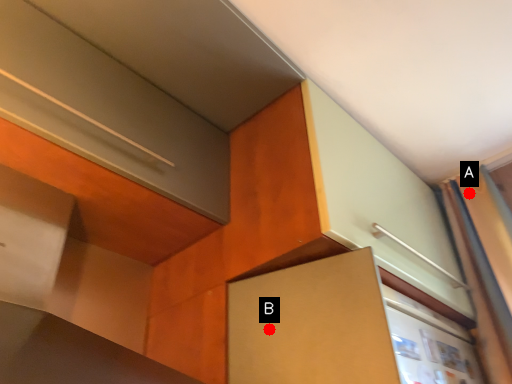
Question: Two points are circled on the image, labeled by A and B beside each circle. Which point appears farthest from the camera in this image?

Choices:
 (A) A is further
 (B) B is further

Answer: (A)